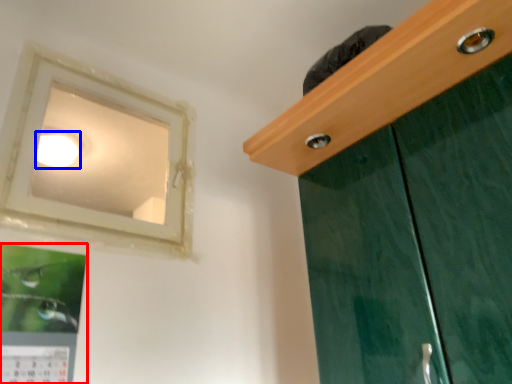
Question: Which object appears closest to the camera in this image, picture frame (highlighted by a red box) or lighting (highlighted by a blue box)?

Choices:
 (A) picture frame
 (B) lighting

Answer: (A)